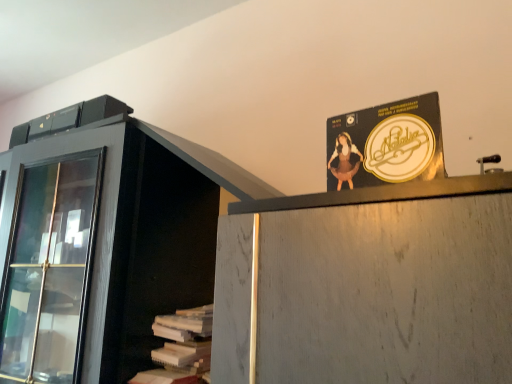
Question: Is gold metallic record album at upper center aimed at white paper stack at lower left?

Choices:
 (A) yes
 (B) no

Answer: (B)

Question: Would you say gold metallic record album at upper center is outside white paper stack at lower left?

Choices:
 (A) no
 (B) yes

Answer: (B)

Question: Is gold metallic record album at upper center wider than white paper stack at lower left?

Choices:
 (A) no
 (B) yes

Answer: (A)

Question: Is gold metallic record album at upper center at the right side of white paper stack at lower left?

Choices:
 (A) yes
 (B) no

Answer: (A)

Question: Can you confirm if gold metallic record album at upper center is bigger than white paper stack at lower left?

Choices:
 (A) yes
 (B) no

Answer: (B)

Question: From a real-world perspective, is gold metallic record album at upper center located higher than white paper stack at lower left?

Choices:
 (A) yes
 (B) no

Answer: (A)

Question: From a real-world perspective, is white paper stack at lower left over gold metallic record album at upper center?

Choices:
 (A) no
 (B) yes

Answer: (A)

Question: Is white paper stack at lower left looking in the opposite direction of gold metallic record album at upper center?

Choices:
 (A) yes
 (B) no

Answer: (B)

Question: Considering the relative sizes of white paper stack at lower left and gold metallic record album at upper center in the image provided, is white paper stack at lower left shorter than gold metallic record album at upper center?

Choices:
 (A) yes
 (B) no

Answer: (B)

Question: Is white paper stack at lower left not near gold metallic record album at upper center?

Choices:
 (A) no
 (B) yes

Answer: (A)

Question: From the image's perspective, does white paper stack at lower left appear lower than gold metallic record album at upper center?

Choices:
 (A) no
 (B) yes

Answer: (B)

Question: Does white paper stack at lower left have a smaller size compared to gold metallic record album at upper center?

Choices:
 (A) no
 (B) yes

Answer: (A)

Question: In terms of size, does gold metallic record album at upper center appear bigger or smaller than white paper stack at lower left?

Choices:
 (A) big
 (B) small

Answer: (B)